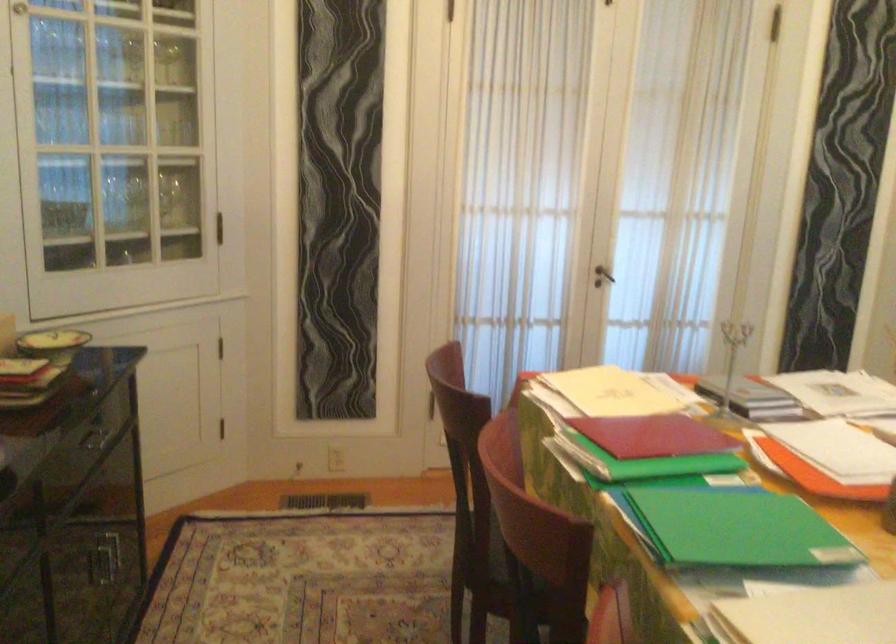
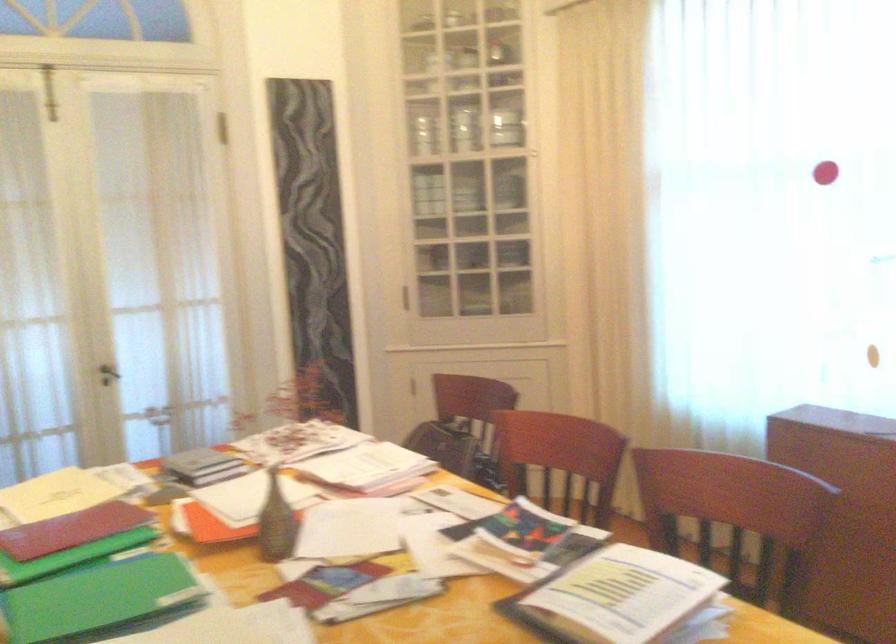
Question: Based on the continuous images, in which direction is the camera rotating? Reply with the corresponding letter.

Choices:
 (A) Left
 (B) Right
 (C) Up
 (D) Down

Answer: (B)